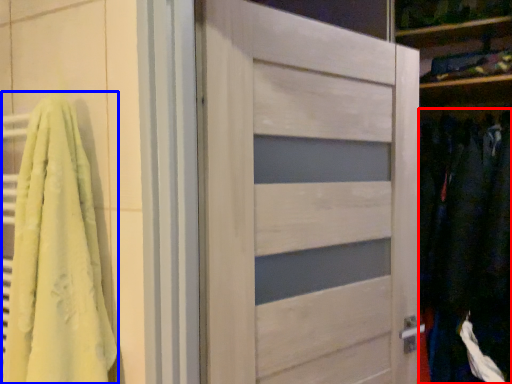
Question: Which of the following is the farthest to the observer, clothing (highlighted by a red box) or bath towel (highlighted by a blue box)?

Choices:
 (A) clothing
 (B) bath towel

Answer: (A)